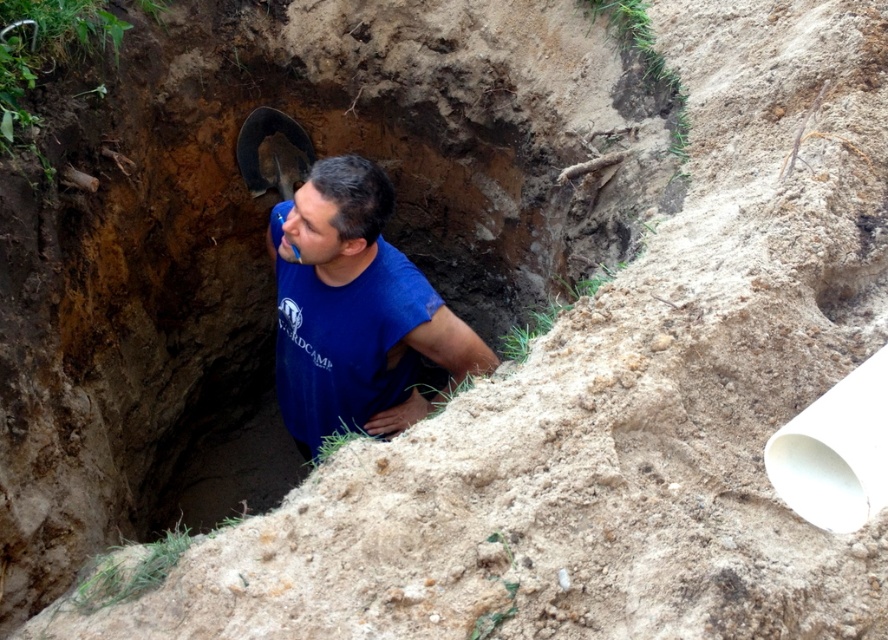
Question: Can you confirm if blue cotton shirt at center is smaller than brown dirt hole at center?

Choices:
 (A) no
 (B) yes

Answer: (A)

Question: Does blue cotton shirt at center lie in front of brown dirt hole at center?

Choices:
 (A) yes
 (B) no

Answer: (A)

Question: Does blue cotton shirt at center have a lesser width compared to brown dirt hole at center?

Choices:
 (A) yes
 (B) no

Answer: (B)

Question: Which object is farther from the camera taking this photo?

Choices:
 (A) brown dirt hole at center
 (B) blue cotton shirt at center

Answer: (A)

Question: Among these points, which one is farthest from the camera?

Choices:
 (A) (236, 456)
 (B) (379, 416)

Answer: (A)